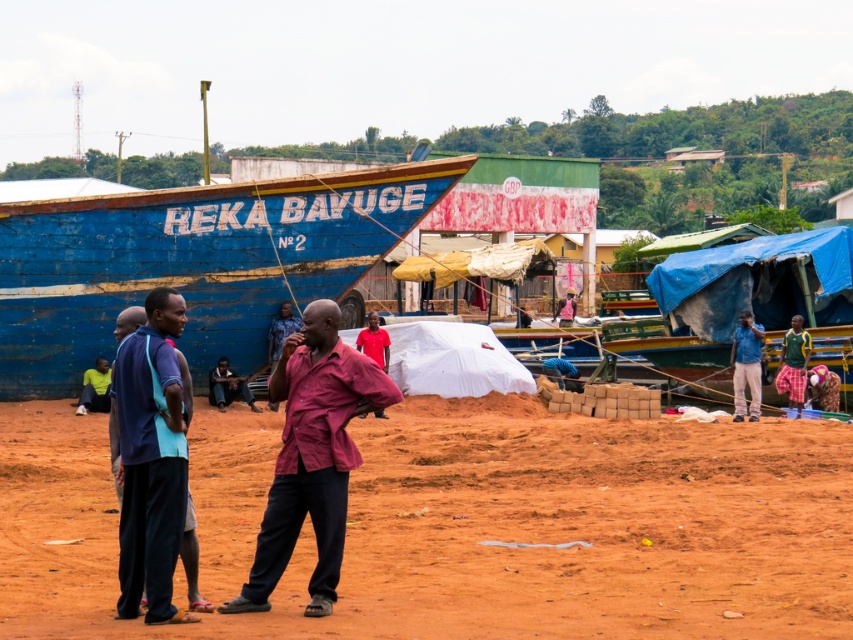
Question: Based on their relative distances, which object is farther from the maroon fabric shirt at center?

Choices:
 (A) blue wooden boat at upper left
 (B) brown sandy dirt at center
 (C) blue fabric pants at left
 (D) blue denim jacket at upper right

Answer: (D)

Question: Does maroon fabric shirt at center have a larger size compared to blue denim jacket at upper right?

Choices:
 (A) no
 (B) yes

Answer: (A)

Question: Among these objects, which one is farthest from the camera?

Choices:
 (A) maroon fabric shirt at center
 (B) blue wooden boat at upper left
 (C) brown sandy dirt at center

Answer: (B)

Question: Which point is farther from the camera taking this photo?

Choices:
 (A) (138, 467)
 (B) (402, 413)

Answer: (B)

Question: Is brown sandy dirt at center to the right of blue wooden boat at upper left from the viewer's perspective?

Choices:
 (A) no
 (B) yes

Answer: (B)

Question: Does brown sandy dirt at center come in front of blue wooden boat at upper left?

Choices:
 (A) yes
 (B) no

Answer: (A)